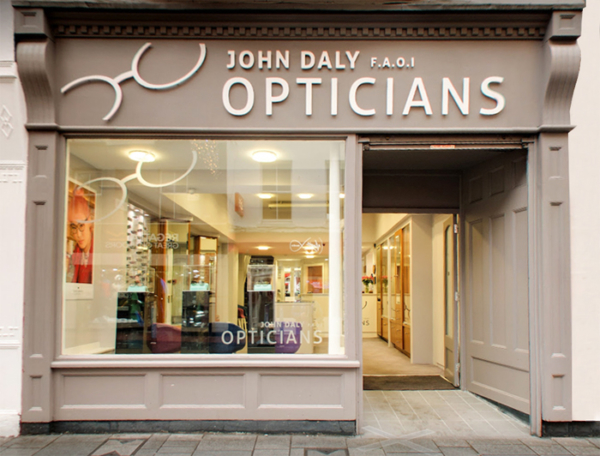
You are a GUI agent. You are given a task and a screenshot of the screen. Output one action in this format:
    pyautogui.click(x=<x>, y=<y>)
    Task: Click on the door
    The image size is (600, 456).
    Given the screenshot: What is the action you would take?
    pyautogui.click(x=451, y=301)